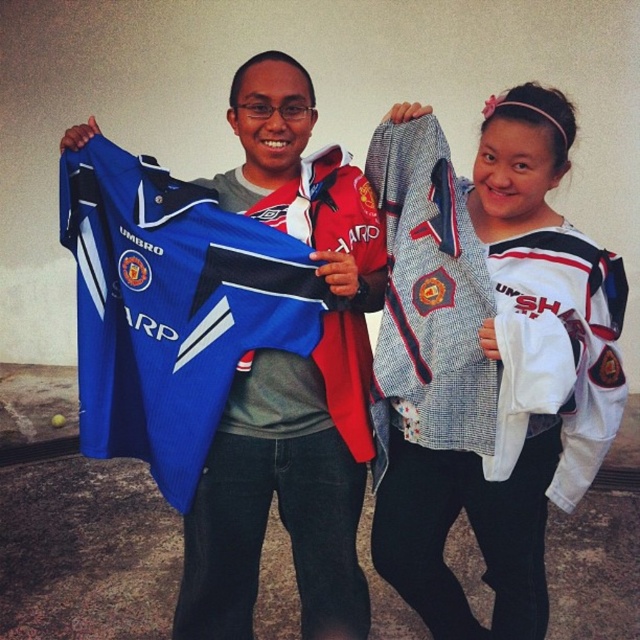
You are standing in front of the image and want to know which of the two points, point (506,97) or point (250,499), is closer to you. Based on the scene, can you determine this?

Point (506,97) is in front of point (250,499), so it is closer to you.